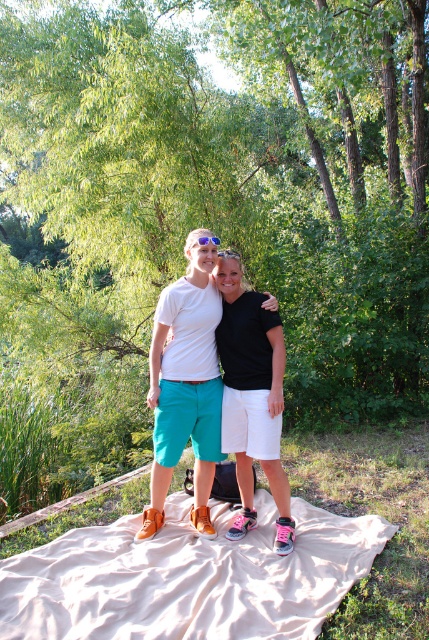
Question: Which object is positioned closest to the blue reflective lens sunglasses at center?

Choices:
 (A) beige fabric blanket at lower center
 (B) black matte shorts at center

Answer: (B)

Question: Does matte teal shorts at center appear under black matte shorts at center?

Choices:
 (A) yes
 (B) no

Answer: (B)

Question: Can you confirm if beige fabric blanket at lower center is smaller than black matte shorts at center?

Choices:
 (A) yes
 (B) no

Answer: (B)

Question: Which object is positioned closest to the matte teal shorts at center?

Choices:
 (A) blue reflective lens sunglasses at center
 (B) black matte shorts at center
 (C) beige fabric blanket at lower center

Answer: (B)

Question: Is matte teal shorts at center thinner than black matte shorts at center?

Choices:
 (A) yes
 (B) no

Answer: (B)

Question: Which object is farther from the camera taking this photo?

Choices:
 (A) beige fabric blanket at lower center
 (B) matte teal shorts at center

Answer: (B)